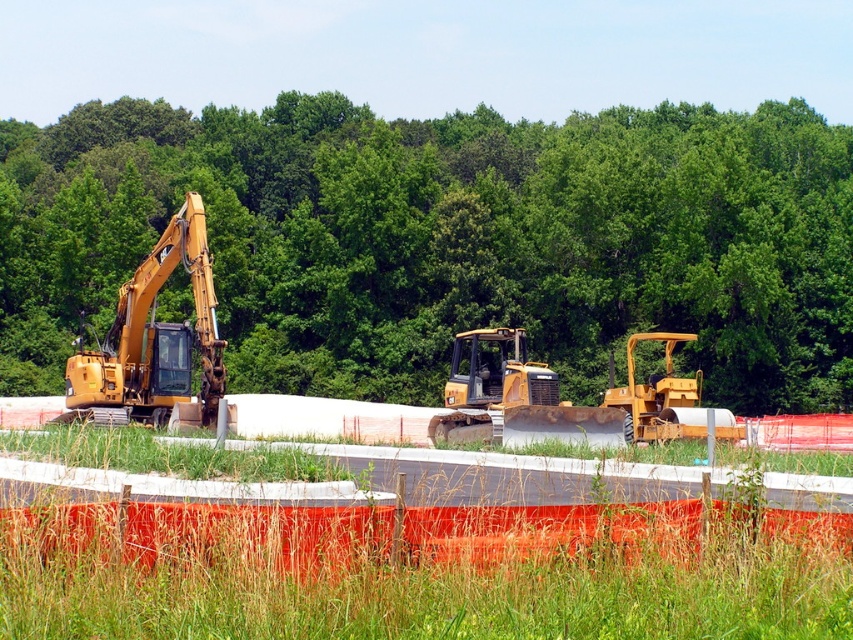
Question: Which point is farther to the camera?

Choices:
 (A) (329, 387)
 (B) (120, 288)
 (C) (498, 545)
 (D) (700, 412)

Answer: (A)

Question: Is green leafy trees at upper center in front of yellow rubber tractor at right?

Choices:
 (A) no
 (B) yes

Answer: (A)

Question: Does green leafy trees at upper center appear on the left side of yellow metallic excavator at left?

Choices:
 (A) no
 (B) yes

Answer: (B)

Question: Which object appears closest to the camera in this image?

Choices:
 (A) green leafy trees at upper center
 (B) yellow metallic excavator at left
 (C) yellow metallic bulldozer at center

Answer: (C)

Question: Which point is farther from the camera taking this photo?

Choices:
 (A) (397, 301)
 (B) (701, 436)
 (C) (126, 317)

Answer: (A)

Question: Is yellow metallic excavator at left bigger than yellow rubber tractor at right?

Choices:
 (A) no
 (B) yes

Answer: (A)